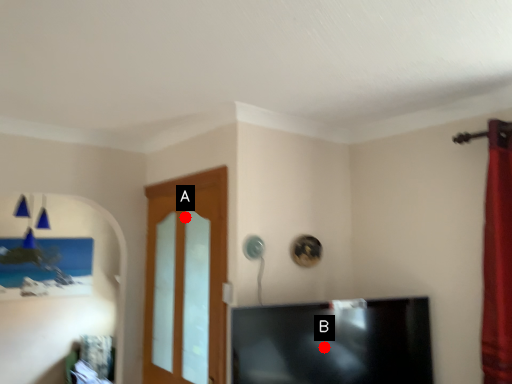
Question: Two points are circled on the image, labeled by A and B beside each circle. Which of the following is the farthest from the observer?

Choices:
 (A) A is further
 (B) B is further

Answer: (A)